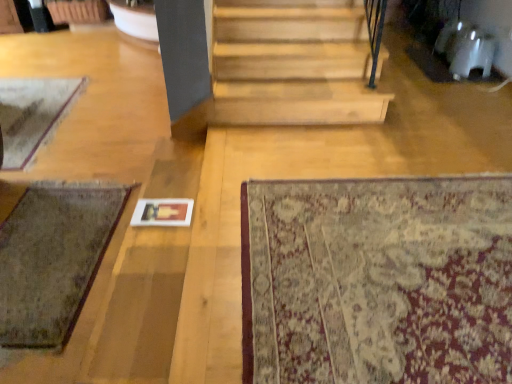
Question: Is beige floral rug at lower right, acting as the 1th mat starting from the right, turned away from green woolen mat at lower left, the second mat viewed from the back?

Choices:
 (A) yes
 (B) no

Answer: (B)

Question: From a real-world perspective, does beige floral rug at lower right, acting as the 1th mat starting from the right, sit lower than green woolen mat at lower left, which is the second mat from front to back?

Choices:
 (A) yes
 (B) no

Answer: (B)

Question: From a real-world perspective, is beige floral rug at lower right, the 3th mat from the left, on green woolen mat at lower left, acting as the second mat starting from the right?

Choices:
 (A) no
 (B) yes

Answer: (B)

Question: Considering the relative positions of beige floral rug at lower right, acting as the 1th mat starting from the front, and green woolen mat at lower left, which is the second mat from front to back, in the image provided, is beige floral rug at lower right, acting as the 1th mat starting from the front, to the left of green woolen mat at lower left, which is the second mat from front to back, from the viewer's perspective?

Choices:
 (A) no
 (B) yes

Answer: (A)

Question: Is beige floral rug at lower right, the 3th mat from the left, thinner than green woolen mat at lower left, the second mat positioned from the left?

Choices:
 (A) yes
 (B) no

Answer: (B)

Question: Based on their positions, is beige floral rug at lower right, acting as the 1th mat starting from the front, located to the left or right of green woolen mat at lower left, which is the second mat from front to back?

Choices:
 (A) right
 (B) left

Answer: (A)

Question: In the image, is beige floral rug at lower right, acting as the 1th mat starting from the right, positioned in front of or behind green woolen mat at lower left, acting as the second mat starting from the right?

Choices:
 (A) behind
 (B) front

Answer: (B)

Question: Which is correct: beige floral rug at lower right, acting as the 1th mat starting from the right, is inside green woolen mat at lower left, the second mat positioned from the left, or outside of it?

Choices:
 (A) outside
 (B) inside

Answer: (A)

Question: From the image's perspective, is beige floral rug at lower right, the 3th mat from the left, above or below green woolen mat at lower left, which is the second mat from front to back?

Choices:
 (A) above
 (B) below

Answer: (A)

Question: Considering the positions of green woolen mat at lower left, acting as the second mat starting from the right, and beige floral rug at lower right, the 3th mat from the left, in the image, is green woolen mat at lower left, acting as the second mat starting from the right, taller or shorter than beige floral rug at lower right, the 3th mat from the left,?

Choices:
 (A) short
 (B) tall

Answer: (B)

Question: From a real-world perspective, is green woolen mat at lower left, the second mat positioned from the left, positioned above or below beige floral rug at lower right, which is counted as the 3th mat, starting from the back?

Choices:
 (A) above
 (B) below

Answer: (B)

Question: Based on their sizes in the image, would you say green woolen mat at lower left, acting as the second mat starting from the right, is bigger or smaller than beige floral rug at lower right, acting as the 1th mat starting from the right?

Choices:
 (A) big
 (B) small

Answer: (B)

Question: Looking at their shapes, would you say green woolen mat at lower left, the second mat positioned from the left, is wider or thinner than beige floral rug at lower right, acting as the 1th mat starting from the front?

Choices:
 (A) wide
 (B) thin

Answer: (B)

Question: From the image's perspective, is worn wool mat at lower left, acting as the 3th mat starting from the front, above or below beige floral rug at lower right, acting as the 1th mat starting from the front?

Choices:
 (A) below
 (B) above

Answer: (B)

Question: In the image, is worn wool mat at lower left, the first mat positioned from the back, positioned in front of or behind beige floral rug at lower right, acting as the 1th mat starting from the front?

Choices:
 (A) behind
 (B) front

Answer: (A)